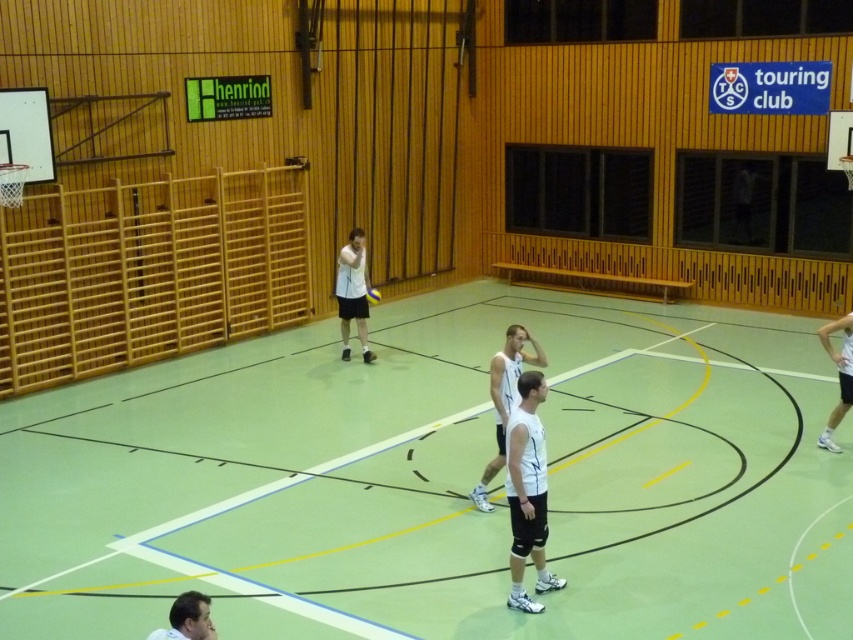
Question: Can you confirm if white matte/vinyl shorts at center is wider than smooth white shirt at lower center?

Choices:
 (A) no
 (B) yes

Answer: (B)

Question: Is white matte/vinyl shorts at center below smooth white shirt at lower center?

Choices:
 (A) yes
 (B) no

Answer: (B)

Question: Among these objects, which one is farthest from the camera?

Choices:
 (A) smooth white shirt at lower center
 (B) white matte/vinyl shorts at center

Answer: (B)

Question: Does white matte/vinyl shorts at center appear on the left side of smooth white shirt at lower center?

Choices:
 (A) no
 (B) yes

Answer: (A)